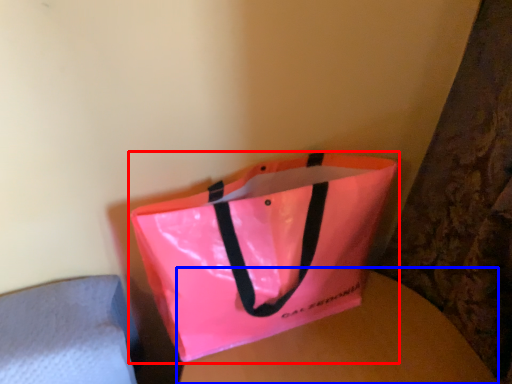
Question: Which point is further to the camera, handbag (highlighted by a red box) or round table (highlighted by a blue box)?

Choices:
 (A) handbag
 (B) round table

Answer: (B)